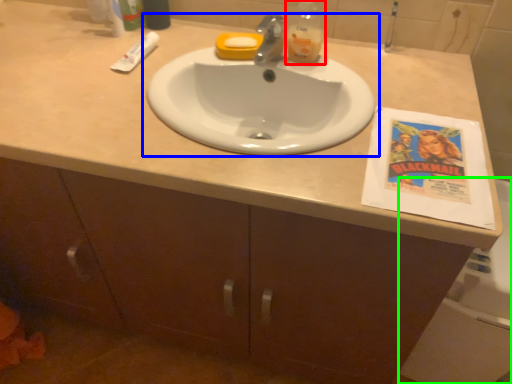
Question: Which is farther away from bottle (highlighted by a red box)? sink (highlighted by a blue box) or bath (highlighted by a green box)?

Choices:
 (A) sink
 (B) bath

Answer: (B)